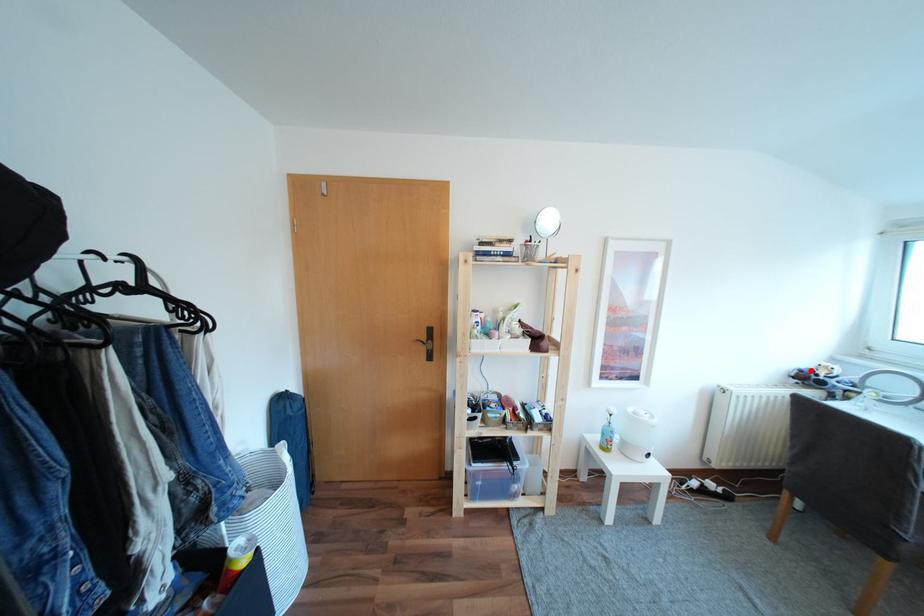
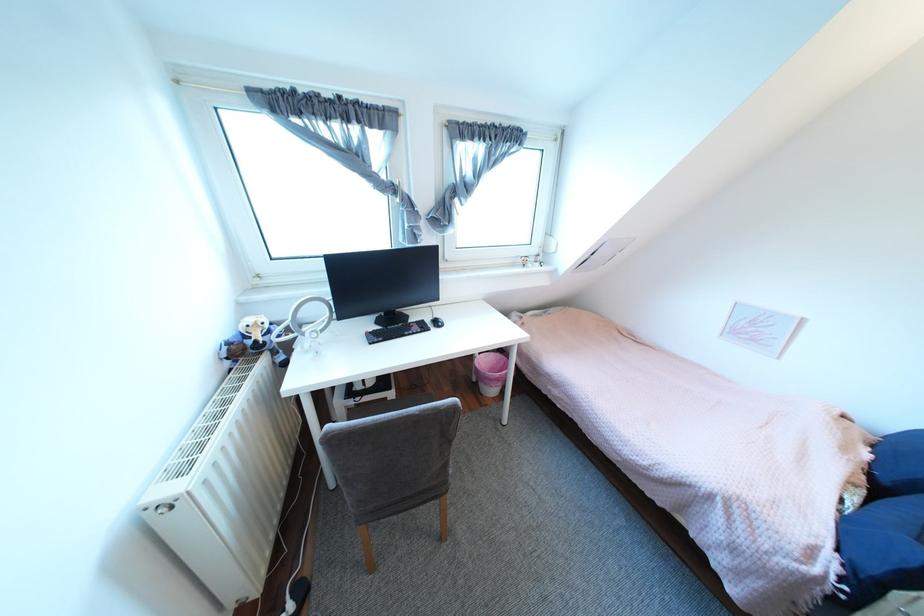
Where in the second image is the point corresponding to the highlighted location from the first image?

(239, 342)